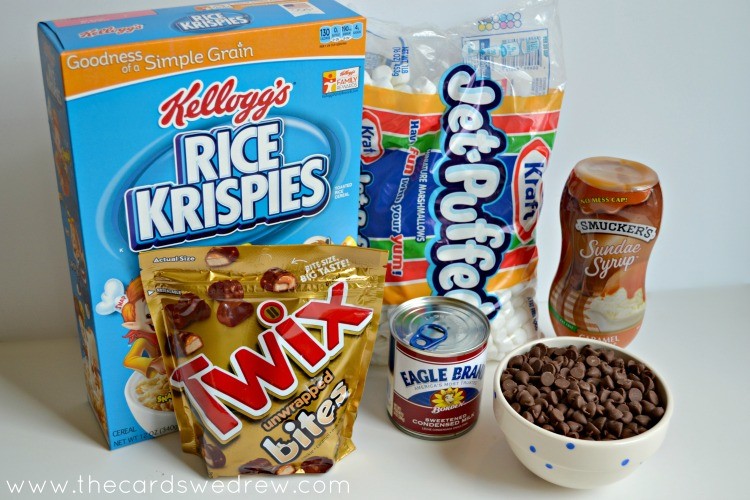
Identify the location of bottle. This screenshot has width=750, height=500. (616, 280).